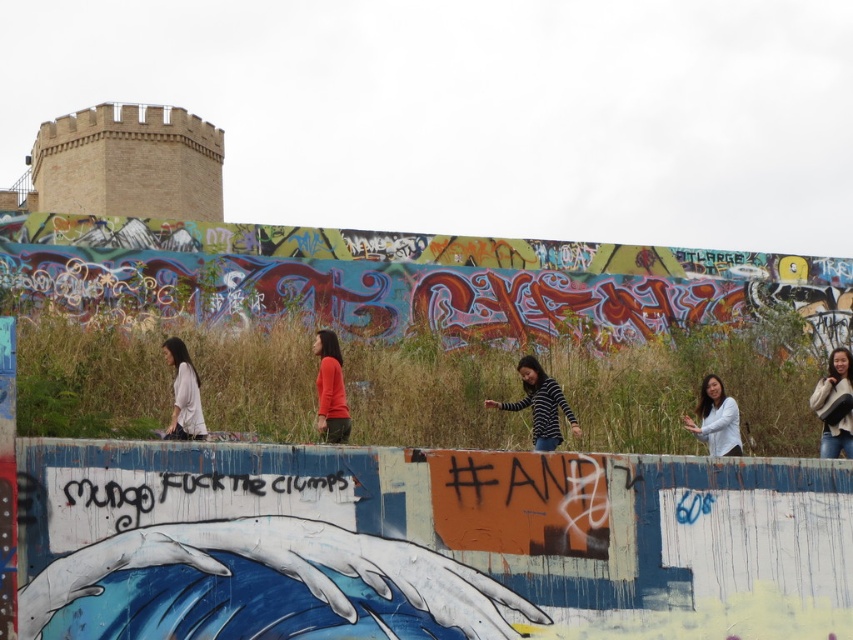
You are an observer standing in front of the graffiti wall. You notice two people wearing the matte orange sweater at center and the white matte shirt at lower right. Which person is higher up on the wall?

The matte orange sweater at center is located above the white matte shirt at lower right, so the person wearing the matte orange sweater at center is higher up on the wall.

You are an artist planning to add a new design to the graffiti wall. You notice the white sweater at upper right and the matte orange sweater at center. Which sweater has a larger width, and how does this affect your design placement?

The white sweater at upper right has a larger width than the matte orange sweater at center. This means you should consider placing your design near the white sweater at upper right to maintain visual balance, as its greater width can accommodate larger elements without overcrowding the space.